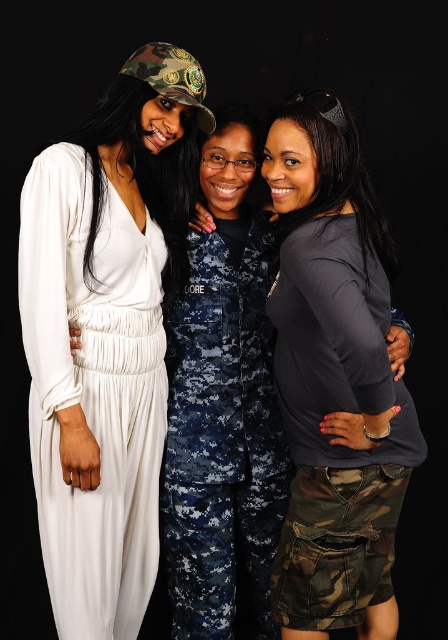
Does dark gray matte shirt at center have a greater width compared to white silky dress at left?

Yes.

Does dark gray matte shirt at center appear on the left side of white silky dress at left?

Incorrect, dark gray matte shirt at center is not on the left side of white silky dress at left.

Is point (361, 304) closer to viewer compared to point (70, 186)?

Yes.

Identify the location of dark gray matte shirt at center. The image size is (448, 640). (335, 381).